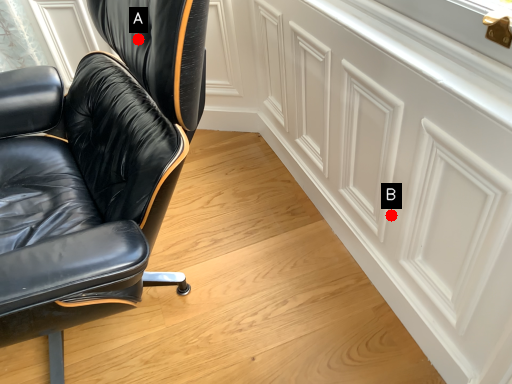
Question: Two points are circled on the image, labeled by A and B beside each circle. Among these points, which one is farthest from the camera?

Choices:
 (A) A is further
 (B) B is further

Answer: (B)